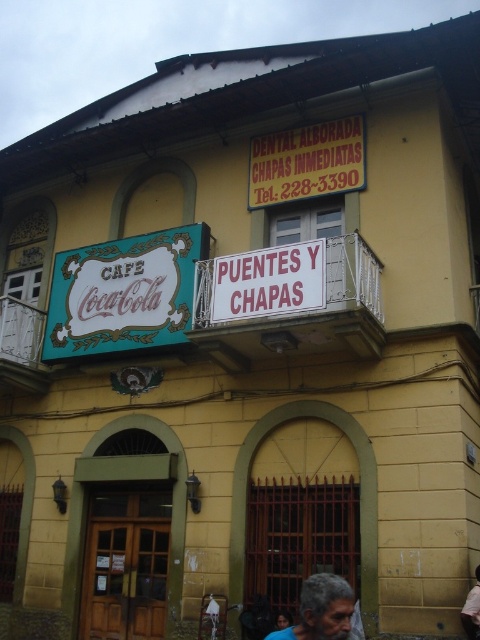
Who is more distant from viewer, (257, 173) or (475, 602)?

The point (257, 173) is behind.

Does point (276, 189) come behind point (468, 630)?

That is True.

Locate an element on the screen. This screenshot has height=640, width=480. yellow plastic sign at upper center is located at coordinates (307, 163).

The width and height of the screenshot is (480, 640). What do you see at coordinates (301, 314) in the screenshot?
I see `white metal balcony at upper center` at bounding box center [301, 314].

You are a GUI agent. You are given a task and a screenshot of the screen. Output one action in this format:
    pyautogui.click(x=<x>, y=<y>)
    Task: Click on the white metal balcony at upper center
    The image size is (480, 640).
    Given the screenshot: What is the action you would take?
    pyautogui.click(x=301, y=314)

Where is `white metal balcony at upper center`? The image size is (480, 640). white metal balcony at upper center is located at coordinates (301, 314).

Based on the photo, is white painted wood at upper left positioned at the back of light brown skin at lower right?

Yes.

Which is in front, point (21, 324) or point (465, 608)?

Point (465, 608)

Identify the location of white painted wood at upper left. This screenshot has height=640, width=480. (22, 346).